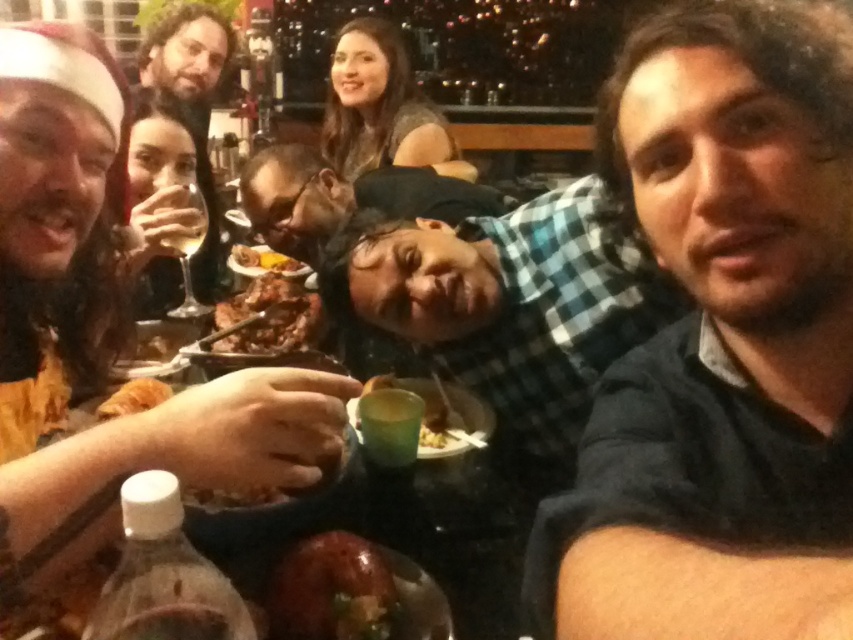
Question: Does golden brown bread at lower left have a lesser width compared to translucent glass wine at upper left?

Choices:
 (A) yes
 (B) no

Answer: (B)

Question: Is shiny brown gravy at center above translucent plastic cup at center?

Choices:
 (A) yes
 (B) no

Answer: (B)

Question: Which point is closer to the camera taking this photo?

Choices:
 (A) (196, 244)
 (B) (288, 260)
 (C) (283, 150)
 (D) (132, 410)

Answer: (D)

Question: Based on their relative distances, which object is farther from the translucent plastic cup at center?

Choices:
 (A) checkered fabric shirt at center
 (B) dark blue shirt at center
 (C) matte black wine glass at upper left

Answer: (C)

Question: Is translucent plastic cup at center positioned before golden brown bread at lower left?

Choices:
 (A) no
 (B) yes

Answer: (A)

Question: Which of these objects is positioned farthest from the shiny brown gravy at center?

Choices:
 (A) translucent plastic cup at center
 (B) matte black shirt at center
 (C) matte black wine glass at upper left

Answer: (C)